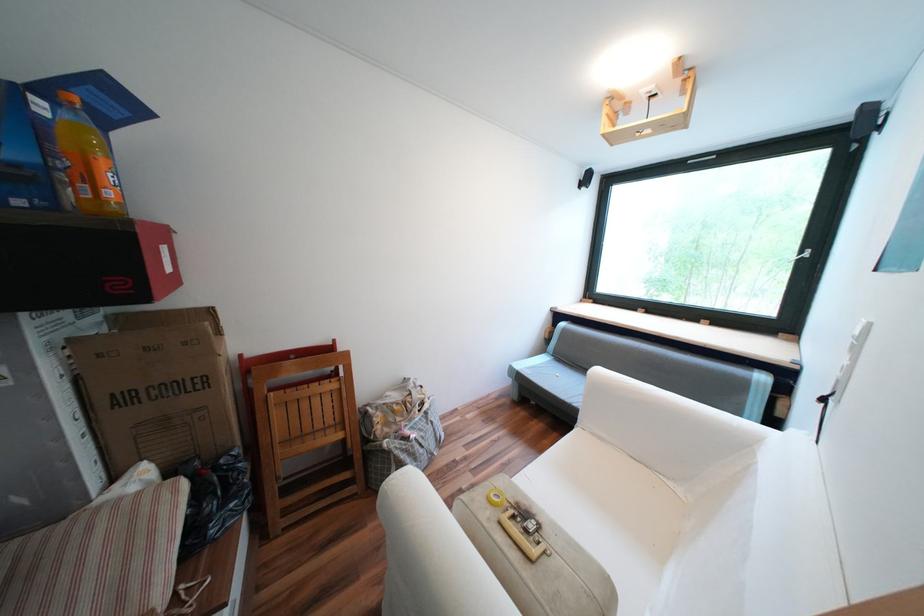
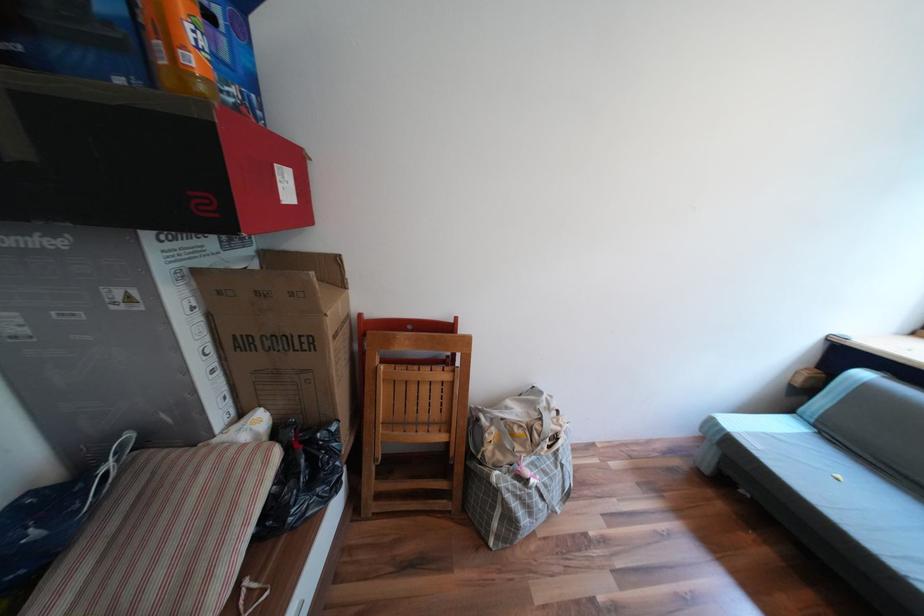
Where in the second image is the point corresponding to pixel 165 500 from the first image?

(258, 464)